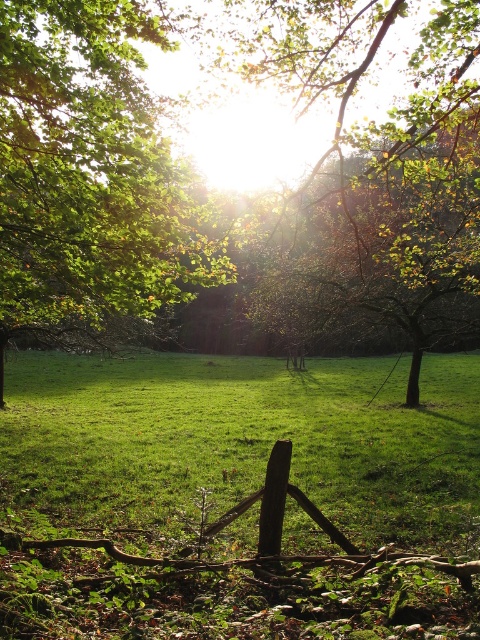
Is green leafy tree at upper left shorter than brown wood fence at center?

In fact, green leafy tree at upper left may be taller than brown wood fence at center.

Between point (17, 131) and point (268, 502), which one is positioned behind?

Positioned behind is point (17, 131).

Where is `green leafy tree at upper left`? green leafy tree at upper left is located at coordinates (87, 173).

Does green grassy field at center have a lesser width compared to brown wood fence at center?

In fact, green grassy field at center might be wider than brown wood fence at center.

Between point (404, 454) and point (82, 632), which one is positioned in front?

Point (82, 632)

Does point (445, 378) come closer to viewer compared to point (90, 627)?

That is False.

Identify the location of green grassy field at center. This screenshot has height=640, width=480. (243, 442).

Who is higher up, green grassy field at center or green leafy tree at upper left?

Positioned higher is green leafy tree at upper left.

Which is more to the right, green grassy field at center or green leafy tree at upper left?

From the viewer's perspective, green grassy field at center appears more on the right side.

This screenshot has width=480, height=640. I want to click on green grassy field at center, so click(x=243, y=442).